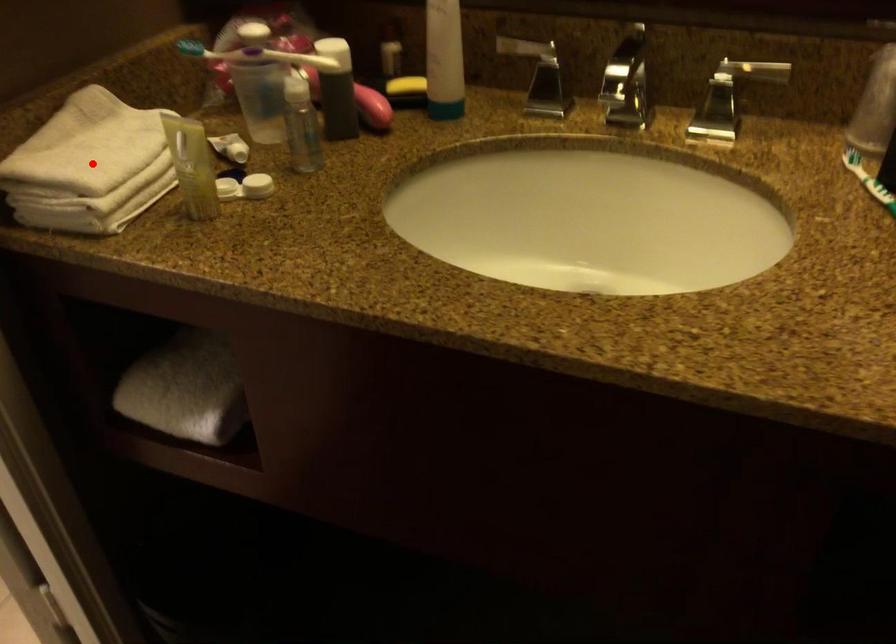
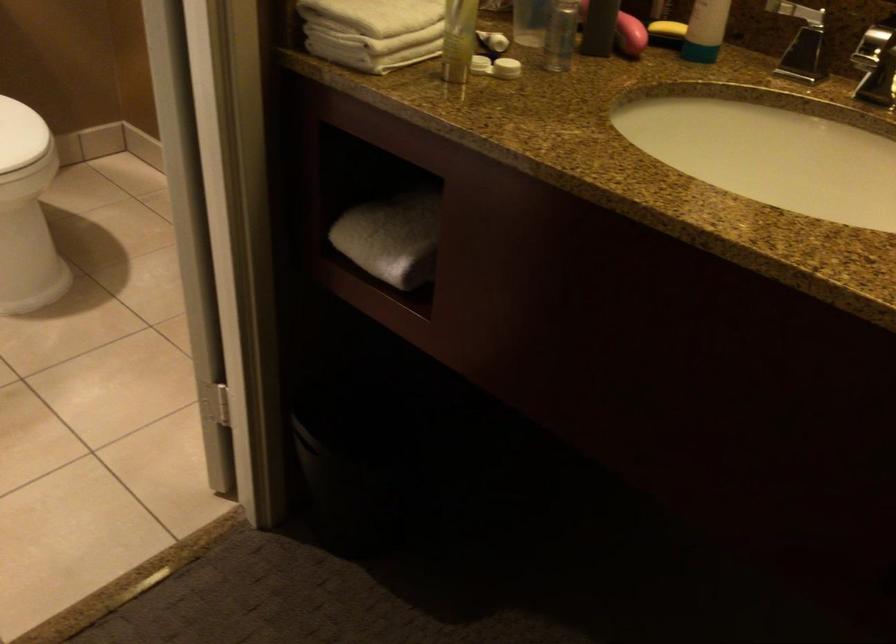
Question: I am providing you with two images of the same scene from different viewpoints. Image1 has a red point marked. In image2, the corresponding 3D location appears at what relative position? Reply with the corresponding letter.

Choices:
 (A) Closer
 (B) Farther

Answer: (B)